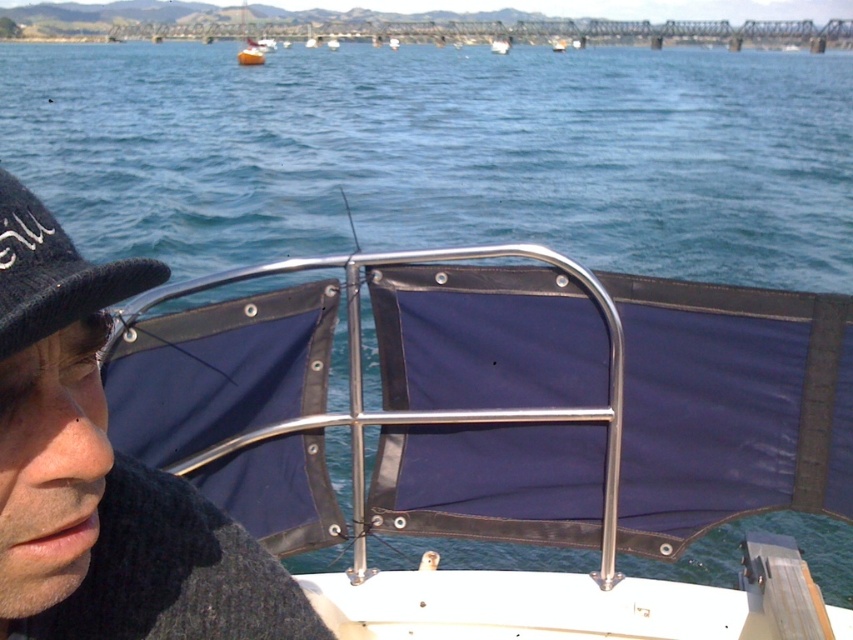
Question: Which is nearer to the metallic silver boat at center?

Choices:
 (A) blue water at center
 (B) black fabric baseball hat at left
 (C) black knit cap at left

Answer: (A)

Question: Is silver metallic rail at center bigger than metallic silver boat at center?

Choices:
 (A) yes
 (B) no

Answer: (B)

Question: Which point is closer to the camera?

Choices:
 (A) black fabric baseball hat at left
 (B) metallic silver boat at center

Answer: (A)

Question: Considering the relative positions of blue water at center and silver metallic rail at center in the image provided, where is blue water at center located with respect to silver metallic rail at center?

Choices:
 (A) left
 (B) right

Answer: (A)

Question: Which object is positioned farthest from the metallic silver boat at center?

Choices:
 (A) black knit cap at left
 (B) silver metallic rail at center
 (C) blue water at center

Answer: (A)

Question: Is silver metallic rail at center below black fabric baseball hat at left?

Choices:
 (A) yes
 (B) no

Answer: (A)